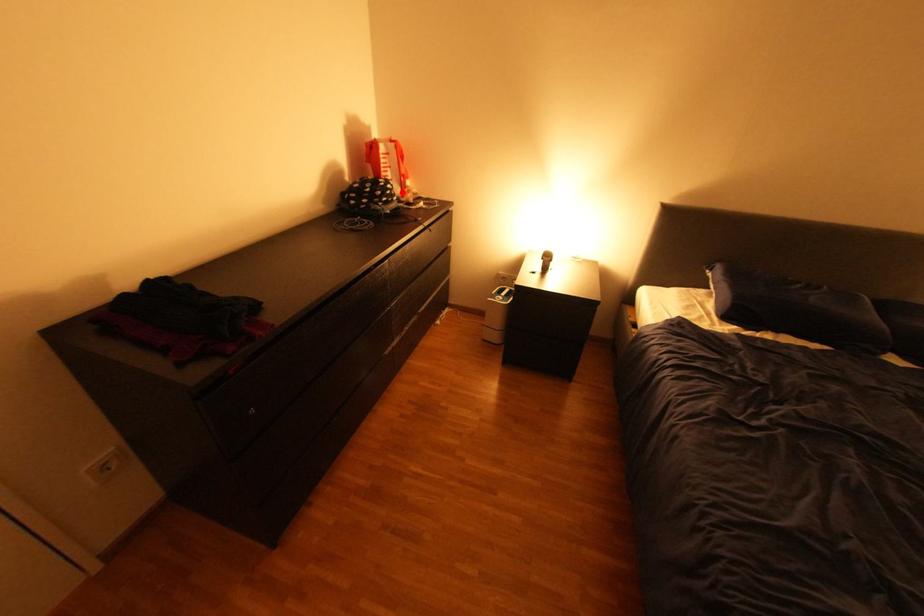
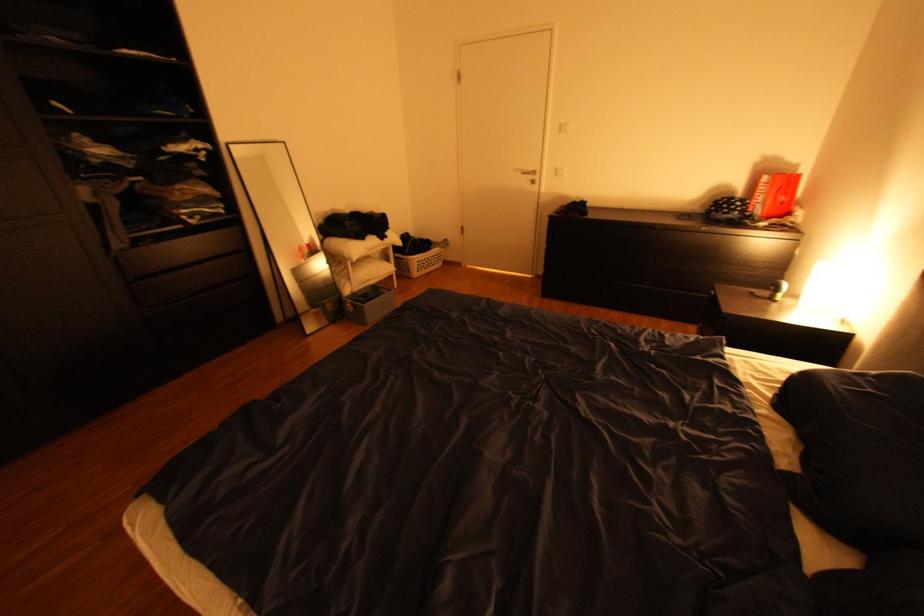
Question: I am providing you with two images of the same scene from different viewpoints. Image1 has a red point marked. In image2, the corresponding 3D location appears at what relative position? Reply with the corresponding letter.

Choices:
 (A) Closer
 (B) Farther

Answer: (B)